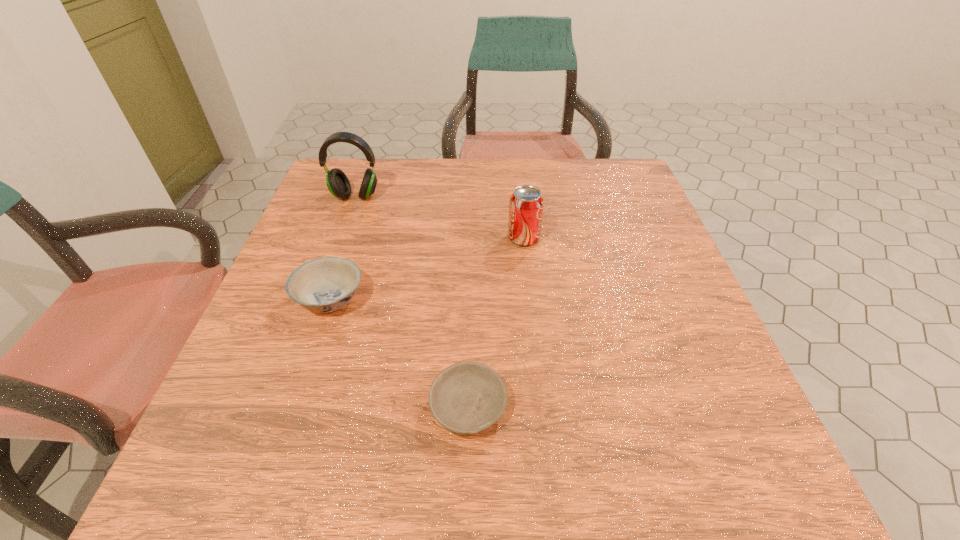
The width and height of the screenshot is (960, 540). Find the location of `free space between the second shortest object and the tallest object`. free space between the second shortest object and the tallest object is located at coordinates (343, 247).

Locate an element on the screen. This screenshot has width=960, height=540. vacant area that lies between the farthest object and the second shortest object is located at coordinates (343, 247).

Locate an element on the screen. This screenshot has height=540, width=960. vacant space that is in between the taller bowl and the rightmost object is located at coordinates (427, 268).

The height and width of the screenshot is (540, 960). In order to click on object that stands as the second closest to the third nearest object in this screenshot , I will do `click(338, 184)`.

Locate which object is the second closest to the third farthest object. Please provide its 2D coordinates. Your answer should be formatted as a tuple, i.e. [(x, y)], where the tuple contains the x and y coordinates of a point satisfying the conditions above.

[(338, 184)]

The image size is (960, 540). Find the location of `blank area in the image that satisfies the following two spatial constraints: 1. on the ear cups of the headset; 2. on the right side of the taller bowl`. blank area in the image that satisfies the following two spatial constraints: 1. on the ear cups of the headset; 2. on the right side of the taller bowl is located at coordinates (319, 299).

Where is `vacant space that satisfies the following two spatial constraints: 1. on the ear cups of the farthest object; 2. on the right side of the second tallest object`? vacant space that satisfies the following two spatial constraints: 1. on the ear cups of the farthest object; 2. on the right side of the second tallest object is located at coordinates (341, 238).

I want to click on free space that satisfies the following two spatial constraints: 1. on the ear cups of the farthest object; 2. on the right side of the farther bowl, so click(319, 299).

Locate an element on the screen. Image resolution: width=960 pixels, height=540 pixels. vacant space that satisfies the following two spatial constraints: 1. on the ear cups of the rightmost object; 2. on the right side of the headset is located at coordinates coord(341,238).

Where is `vacant space that satisfies the following two spatial constraints: 1. on the ear cups of the nearer bowl; 2. on the left side of the headset`? The height and width of the screenshot is (540, 960). vacant space that satisfies the following two spatial constraints: 1. on the ear cups of the nearer bowl; 2. on the left side of the headset is located at coordinates (279, 407).